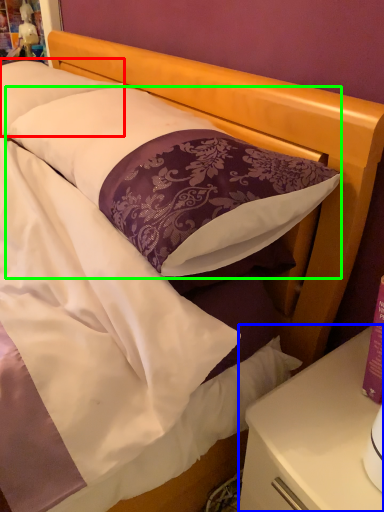
Question: Which object is the farthest from pillow (highlighted by a red box)? Choose among these: nightstand (highlighted by a blue box) or pillow (highlighted by a green box).

Choices:
 (A) nightstand
 (B) pillow

Answer: (A)